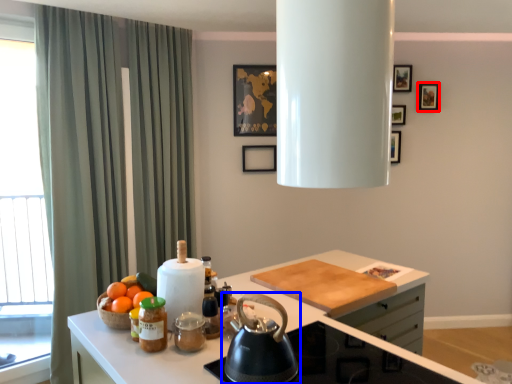
Question: Which of the following is the farthest to the observer, picture frame (highlighted by a red box) or kettle (highlighted by a blue box)?

Choices:
 (A) picture frame
 (B) kettle

Answer: (A)